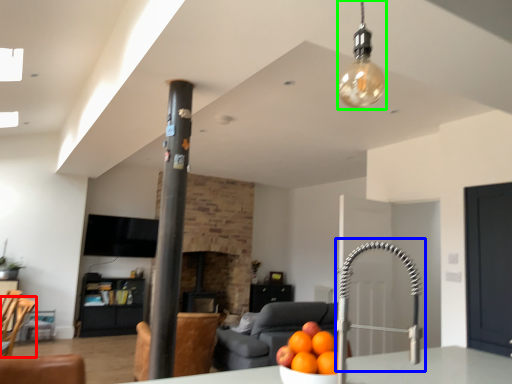
Question: Which object is the closest to the swivel chair (highlighted by a red box)? Choose among these: faucet (highlighted by a blue box) or light fixture (highlighted by a green box).

Choices:
 (A) faucet
 (B) light fixture

Answer: (A)